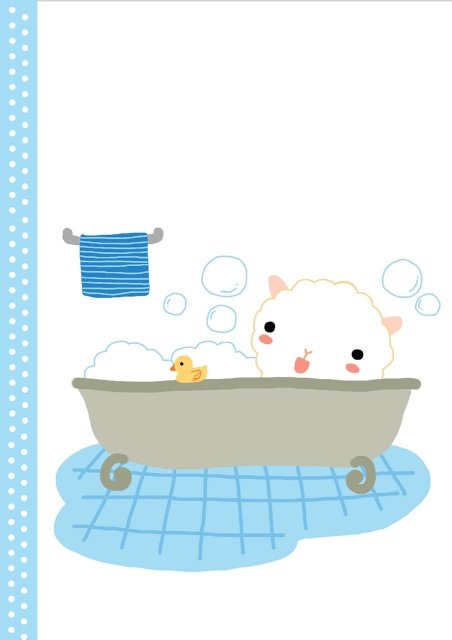
Question: Is fluffy white lamb at center to the right of yellow rubber duck at center from the viewer's perspective?

Choices:
 (A) yes
 (B) no

Answer: (A)

Question: Among these points, which one is nearest to the camera?

Choices:
 (A) [268, 403]
 (B) [193, 372]

Answer: (A)

Question: Which point appears closest to the camera in this image?

Choices:
 (A) (179, 362)
 (B) (319, 339)
 (C) (323, 384)

Answer: (C)

Question: Which of these objects is positioned farthest from the yellow rubber duck at center?

Choices:
 (A) fluffy white lamb at center
 (B) smooth beige bathtub at center

Answer: (A)

Question: Does smooth beige bathtub at center appear on the left side of yellow rubber duck at center?

Choices:
 (A) yes
 (B) no

Answer: (B)

Question: Is smooth beige bathtub at center closer to camera compared to fluffy white lamb at center?

Choices:
 (A) yes
 (B) no

Answer: (A)